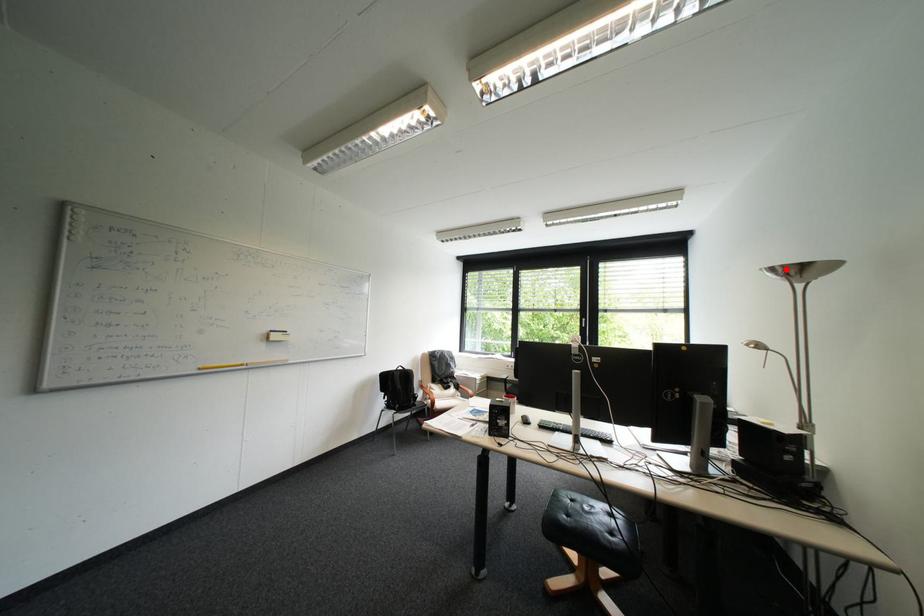
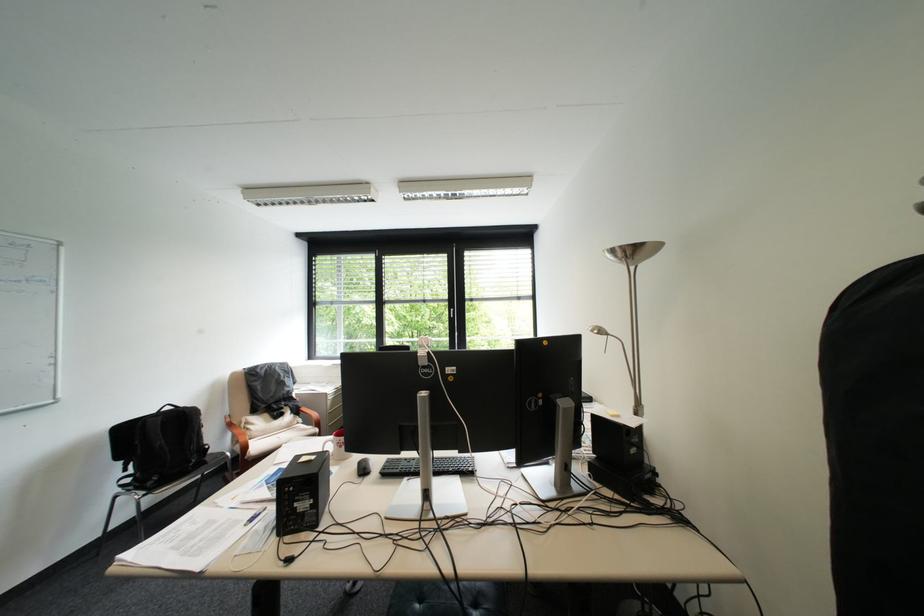
Question: I am providing you with two images of the same scene from different viewpoints. A red point is marked on the first image. Is the red point's position out of view in image 2?

Choices:
 (A) Yes
 (B) No

Answer: (B)